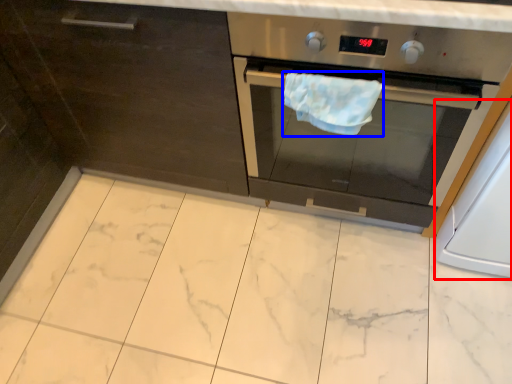
Question: Among these objects, which one is nearest to the camera, appliance (highlighted by a red box) or hand towel (highlighted by a blue box)?

Choices:
 (A) appliance
 (B) hand towel

Answer: (A)